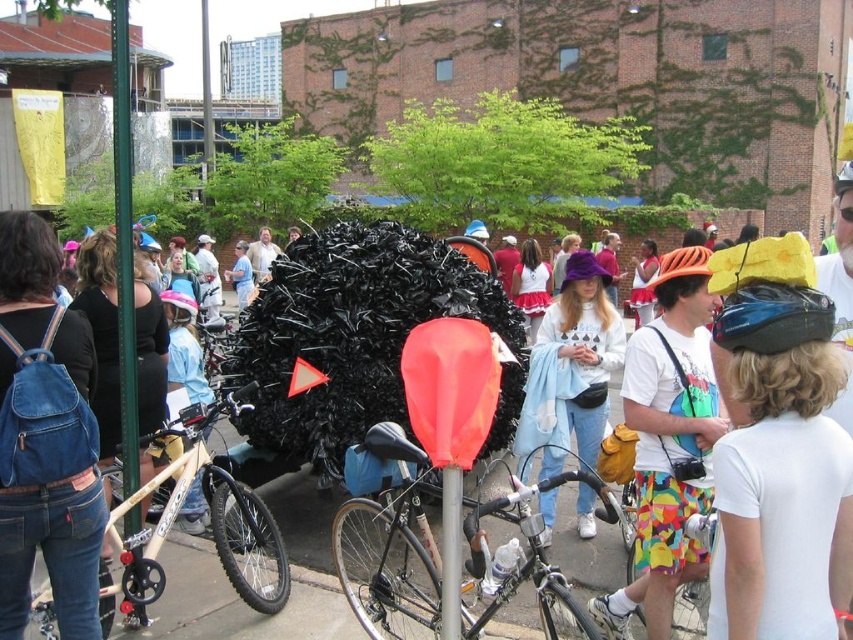
Can you confirm if shiny black bicycle at center is bigger than light blue denim jeans at center?

Actually, shiny black bicycle at center might be smaller than light blue denim jeans at center.

Find the location of a particular element. The image size is (853, 640). shiny black bicycle at center is located at coordinates (387, 545).

Is blue matte helmet at upper right to the right of multicolored fabric shorts at center from the viewer's perspective?

Yes, blue matte helmet at upper right is to the right of multicolored fabric shorts at center.

Is point (833, 420) positioned behind point (711, 385)?

No, it is not.

Who is more distant from viewer, [776,324] or [682,397]?

The point [682,397] is more distant.

Where is `blue matte helmet at upper right`? blue matte helmet at upper right is located at coordinates (781, 474).

Is blue matte helmet at upper right in front of light blue denim jeans at center?

Yes, blue matte helmet at upper right is closer to the viewer.

Can you confirm if blue matte helmet at upper right is taller than light blue denim jeans at center?

No.

At what (x,y) coordinates should I click in order to perform the action: click on blue matte helmet at upper right. Please return your answer as a coordinate pair (x, y). Looking at the image, I should click on (781, 474).